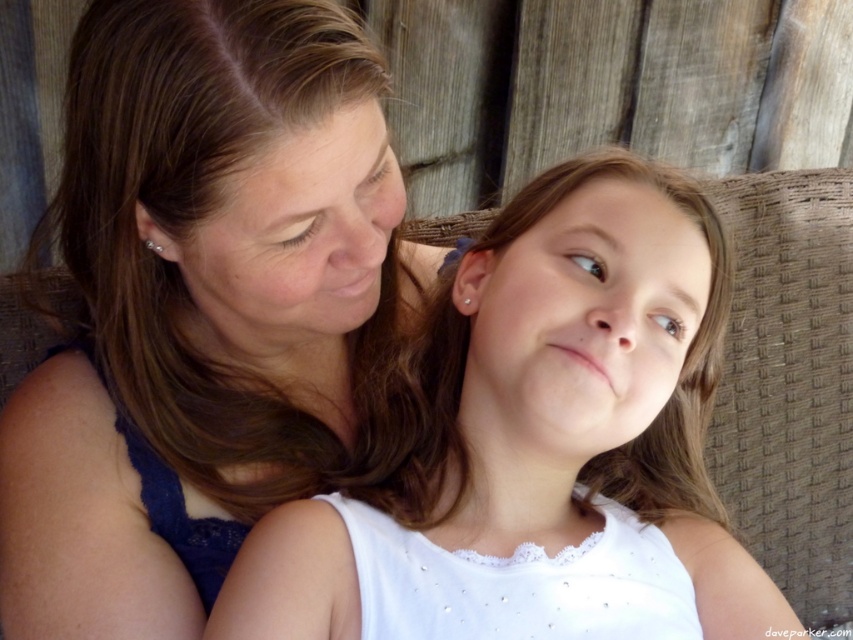
Does matte blue dress at upper left appear on the right side of white fabric at center?

Incorrect, matte blue dress at upper left is not on the right side of white fabric at center.

Does matte blue dress at upper left have a smaller size compared to white fabric at center?

Incorrect, matte blue dress at upper left is not smaller in size than white fabric at center.

Is point (299, 205) positioned in front of point (705, 246)?

Yes, it is in front of point (705, 246).

The image size is (853, 640). What are the coordinates of `matte blue dress at upper left` in the screenshot? It's located at (202, 308).